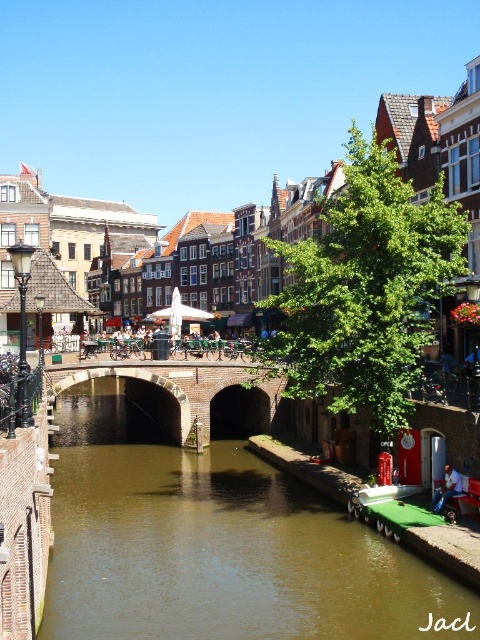
Question: Does brick stone bridge at center appear under blue denim jeans at lower right?

Choices:
 (A) no
 (B) yes

Answer: (A)

Question: Which of these objects is positioned closest to the brown smooth water at center?

Choices:
 (A) brick stone bridge at center
 (B) blue denim jeans at lower right

Answer: (A)

Question: Can you confirm if brick stone bridge at center is positioned to the right of blue denim jeans at lower right?

Choices:
 (A) no
 (B) yes

Answer: (A)

Question: Which object is the closest to the brown smooth water at center?

Choices:
 (A) brick stone bridge at center
 (B) blue denim jeans at lower right

Answer: (A)

Question: Does brown smooth water at center lie behind blue denim jeans at lower right?

Choices:
 (A) no
 (B) yes

Answer: (A)

Question: Which of the following is the farthest from the observer?

Choices:
 (A) (170, 589)
 (B) (210, 435)
 (C) (442, 484)

Answer: (B)